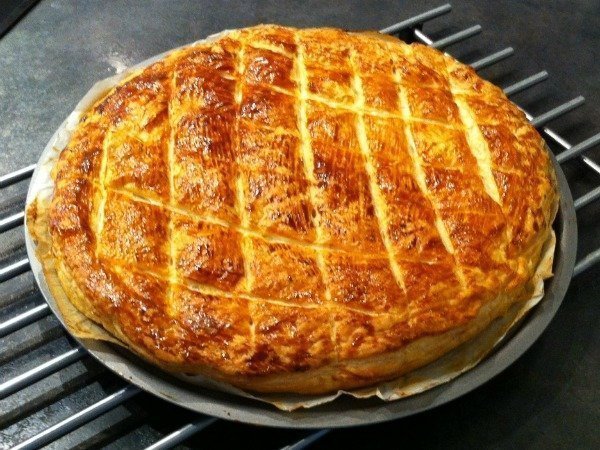
I want to click on metal dish, so click(x=510, y=355).